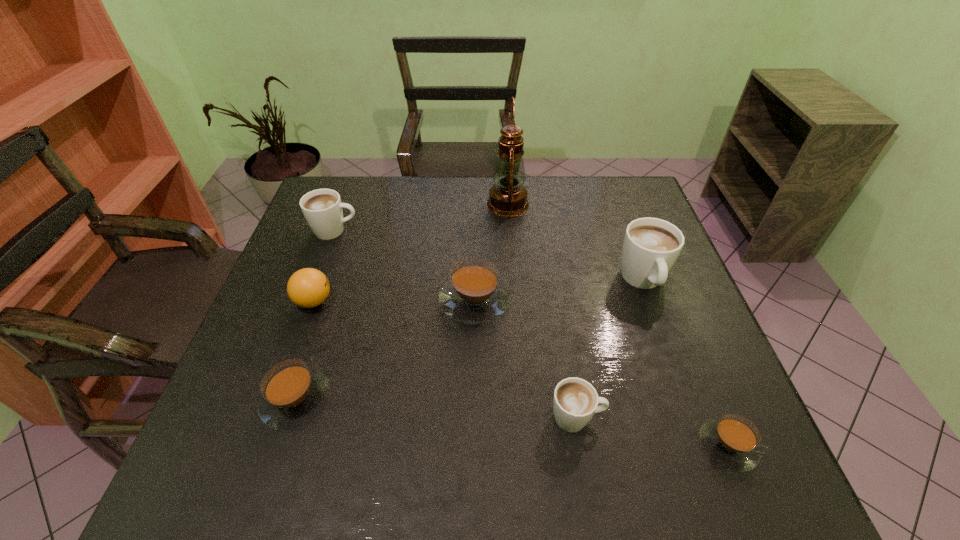
Find the location of a particular element. vacant space at the right edge of the desktop is located at coordinates (669, 340).

Where is `vacant space at the far left corner`? Image resolution: width=960 pixels, height=540 pixels. vacant space at the far left corner is located at coordinates (366, 188).

In the image, there is a desktop. Identify the location of free space at the near left corner. (197, 491).

In the image, there is a desktop. Where is `free space at the far right corner`? Image resolution: width=960 pixels, height=540 pixels. free space at the far right corner is located at coordinates pos(636,192).

Identify the location of free space between the fourth cappuccino from left to right and the ping-pong ball. (445, 360).

In order to click on free space between the fourth cappuccino from right to left and the leftmost brown cappuccino in this screenshot , I will do point(386,350).

The width and height of the screenshot is (960, 540). I want to click on vacant point located between the leftmost brown cappuccino and the smallest white cappuccino, so click(437, 409).

I want to click on free point between the rightmost brown cappuccino and the seventh shortest object, so click(x=685, y=363).

Where is `free space between the ping-pong ball and the tallest object`? free space between the ping-pong ball and the tallest object is located at coordinates (411, 253).

At what (x,y) coordinates should I click in order to perform the action: click on unoccupied area between the smallest white cappuccino and the ping-pong ball. Please return your answer as a coordinate pair (x, y). Looking at the image, I should click on (445, 360).